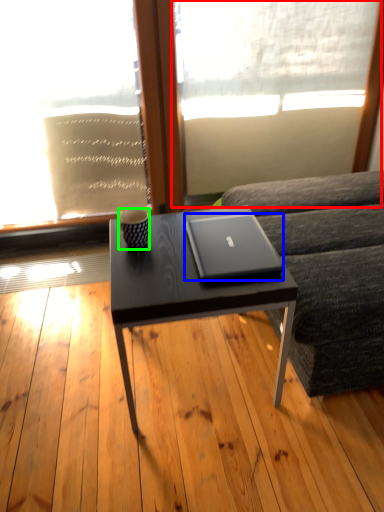
Question: Considering the real-world distances, which object is closest to window screen (highlighted by a red box)? laptop (highlighted by a blue box) or coffee cup (highlighted by a green box).

Choices:
 (A) laptop
 (B) coffee cup

Answer: (A)